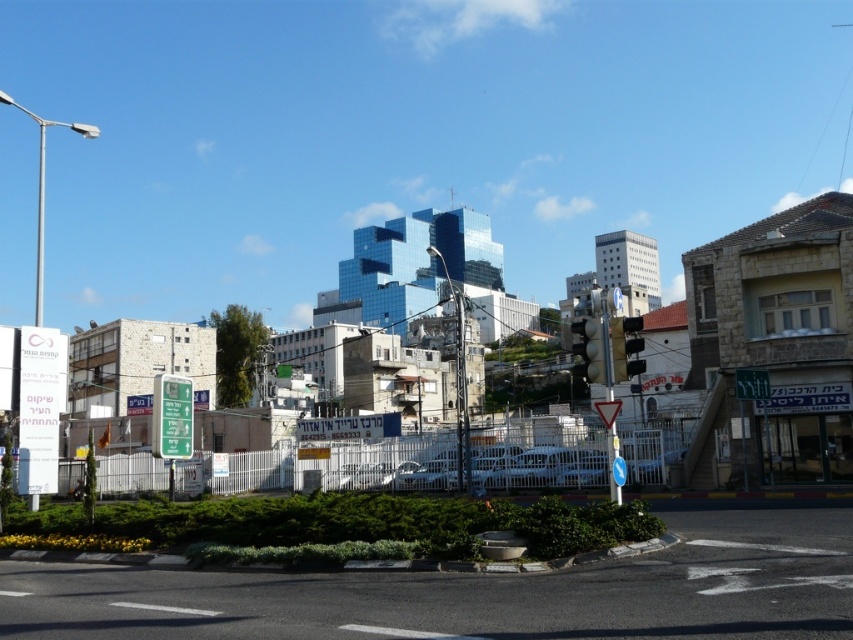
Question: Based on their relative distances, which object is farther from the green plastic sign at lower left?

Choices:
 (A) metallic traffic light at center
 (B) metallic traffic light at center-right

Answer: (A)

Question: Can you confirm if metallic traffic light at center-right is bigger than metallic traffic light at center?

Choices:
 (A) yes
 (B) no

Answer: (B)

Question: Which object appears farthest from the camera in this image?

Choices:
 (A) green plastic sign at lower left
 (B) metallic traffic light at center-right

Answer: (A)

Question: Can you confirm if metallic traffic light at center-right is bigger than metallic traffic light at center?

Choices:
 (A) yes
 (B) no

Answer: (B)

Question: Estimate the real-world distances between objects in this image. Which object is closer to the green plastic sign at lower left?

Choices:
 (A) metallic traffic light at center
 (B) metallic traffic light at center-right

Answer: (B)

Question: Does metallic traffic light at center-right have a lesser width compared to metallic traffic light at center?

Choices:
 (A) yes
 (B) no

Answer: (A)